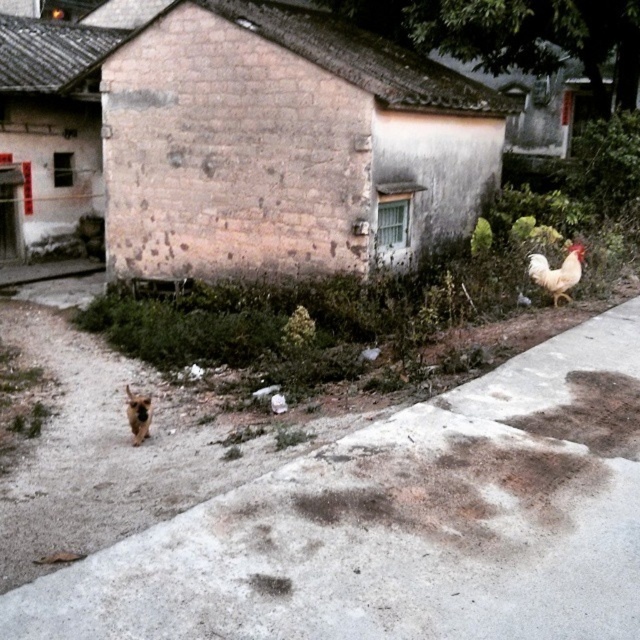
You are standing in front of the weathered stone house. You see a white feathered chicken at upper right and a brown furry dog at lower left. Which animal is closer to you?

The brown furry dog at lower left is behind the white feathered chicken at upper right, so the chicken is closer to you.

In the scene shown: You are standing at the center of the image and want to walk to the gray concrete pavement at lower right. Which direction should you move to reach it?

Since the gray concrete pavement at lower right is located at point (403, 524) in the image, you should move towards the lower right direction to reach it.

You are standing at the entrance of the stone house and want to retrieve your pet dog. Which direction should you move to reach the brown furry dog at lower left before the white feathered chicken at upper right?

The brown furry dog at lower left is located below the white feathered chicken at upper right, so you should move downward to reach the brown furry dog at lower left first.